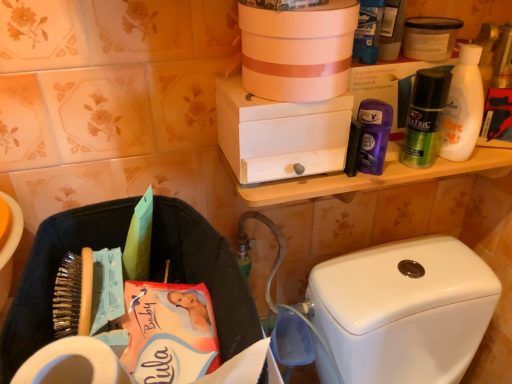
What do you see at coordinates (430, 38) in the screenshot? The height and width of the screenshot is (384, 512). I see `white matte container at upper right` at bounding box center [430, 38].

In order to face white matte toilet paper at lower left, should I rotate leftwards or rightwards?

Rotate left and turn 21.278 degrees.

Identify the location of white matte box at upper center, the second box viewed from the top. (280, 133).

Identify the location of white matte container at upper right. (430, 38).

Is green matte deodorant at upper right, the 2th toiletry when ordered from left to right, positioned far away from white matte container at upper right?

No, there isn't a large distance between green matte deodorant at upper right, the 2th toiletry when ordered from left to right, and white matte container at upper right.

How many degrees apart are the facing directions of green matte deodorant at upper right, which is counted as the 1th toiletry, starting from the right, and white matte container at upper right?

The angular difference between green matte deodorant at upper right, which is counted as the 1th toiletry, starting from the right, and white matte container at upper right is 0.00361 degrees.

Does green matte deodorant at upper right, which is counted as the 1th toiletry, starting from the right, have a lesser height compared to white matte container at upper right?

In fact, green matte deodorant at upper right, which is counted as the 1th toiletry, starting from the right, may be taller than white matte container at upper right.

Locate an element on the screen. The height and width of the screenshot is (384, 512). the 1st toiletry below the white matte container at upper right (from the image's perspective) is located at coordinates (425, 117).

The width and height of the screenshot is (512, 384). Identify the location of laundry basket located underneath the white matte bottle at upper right (from a real-world perspective). (52, 280).

Which is farther from the camera, [41,270] or [452,138]?

The point [452,138] is more distant.

Can you confirm if black fabric laundry basket at lower left is smaller than white matte bottle at upper right?

No, black fabric laundry basket at lower left is not smaller than white matte bottle at upper right.

From the image's perspective, is black fabric laundry basket at lower left positioned above or below white matte bottle at upper right?

black fabric laundry basket at lower left is situated lower than white matte bottle at upper right in the image.

From a real-world perspective, is green matte deodorant at upper right, which is counted as the 1th toiletry, starting from the right, positioned under white matte bottle at upper right based on gravity?

Yes, from a real-world perspective, green matte deodorant at upper right, which is counted as the 1th toiletry, starting from the right, is beneath white matte bottle at upper right.

Would you say green matte deodorant at upper right, which is counted as the 1th toiletry, starting from the right, is to the left or to the right of white matte bottle at upper right in the picture?

green matte deodorant at upper right, which is counted as the 1th toiletry, starting from the right, is positioned on white matte bottle at upper right's left side.

Is green matte deodorant at upper right, the 2th toiletry when ordered from left to right, inside or outside of white matte bottle at upper right?

green matte deodorant at upper right, the 2th toiletry when ordered from left to right, cannot be found inside white matte bottle at upper right.

Does green matte deodorant at upper right, which is counted as the 1th toiletry, starting from the right, touch white matte bottle at upper right?

Yes.

Does white matte container at upper right have a smaller size compared to white matte toilet paper at lower left?

Correct, white matte container at upper right occupies less space than white matte toilet paper at lower left.

Is white matte container at upper right not within white matte toilet paper at lower left?

white matte container at upper right lies outside white matte toilet paper at lower left's area.

From a real-world perspective, is white matte container at upper right above or below white matte toilet paper at lower left?

white matte container at upper right is situated higher than white matte toilet paper at lower left in the real world.

I want to click on toilet paper on the left of white matte container at upper right, so click(73, 364).

Which is in front, white glossy toilet tank at lower right or white matte toilet paper at lower left?

white matte toilet paper at lower left is in front.

Based on the photo, from the image's perspective, between white glossy toilet tank at lower right and white matte toilet paper at lower left, who is located below?

From the image's view, white glossy toilet tank at lower right is below.

From a real-world perspective, does white glossy toilet tank at lower right stand above white matte toilet paper at lower left?

Incorrect, from a real-world perspective, white glossy toilet tank at lower right is lower than white matte toilet paper at lower left.

Is white matte box at upper center, acting as the 1th box starting from the bottom, oriented away from white matte bottle at upper right?

No, white matte box at upper center, acting as the 1th box starting from the bottom, is not facing the opposite direction of white matte bottle at upper right.

Which is in front, point (345, 155) or point (467, 147)?

The point (345, 155) is closer.

Find the location of a particular element. The image size is (512, 384). cleaning product that appears on the right of white matte box at upper center, the second box viewed from the top is located at coordinates (463, 107).

Considering the sizes of objects white matte box at upper center, the second box viewed from the top, and white matte bottle at upper right in the image provided, who is taller, white matte box at upper center, the second box viewed from the top, or white matte bottle at upper right?

white matte bottle at upper right.

From the image's perspective, which is below, white glossy toilet tank at lower right or matte white bucket at upper center, the 2th box from the bottom?

white glossy toilet tank at lower right, from the image's perspective.

How many degrees apart are the facing directions of white glossy toilet tank at lower right and matte white bucket at upper center, the 2th box from the bottom?

1.02 degrees separate the facing orientations of white glossy toilet tank at lower right and matte white bucket at upper center, the 2th box from the bottom.

Considering the relative positions of white glossy toilet tank at lower right and matte white bucket at upper center, the 1th box when ordered from top to bottom, in the image provided, is white glossy toilet tank at lower right to the right of matte white bucket at upper center, the 1th box when ordered from top to bottom, from the viewer's perspective?

Yes.

Considering their positions, is white glossy toilet tank at lower right located in front of or behind matte white bucket at upper center, the 1th box when ordered from top to bottom?

white glossy toilet tank at lower right is positioned farther from the viewer than matte white bucket at upper center, the 1th box when ordered from top to bottom.

You are a GUI agent. You are given a task and a screenshot of the screen. Output one action in this format:
    pyautogui.click(x=<x>, y=<y>)
    Task: Click on the product behind the green matte deodorant at upper right, which is counted as the 1th toiletry, starting from the right
    This screenshot has width=512, height=384.
    Given the screenshot: What is the action you would take?
    pyautogui.click(x=430, y=38)

Locate an element on the screen. laundry basket in front of the white matte bottle at upper right is located at coordinates (52, 280).

Based on the photo, from the image, which object appears to be farther from black fabric laundry basket at lower left, white matte container at upper right or white matte bottle at upper right?

Among the two, white matte container at upper right is located further to black fabric laundry basket at lower left.

From the image, which object appears to be nearer to matte white bucket at upper center, the 1th box when ordered from top to bottom, white matte bottle at upper right or white matte container at upper right?

white matte container at upper right.

Based on their spatial positions, is white matte container at upper right or white matte box at upper center, acting as the 1th box starting from the bottom, further from purple glossy deodorant at upper right, arranged as the first toiletry when viewed from the left?

Among the two, white matte container at upper right is located further to purple glossy deodorant at upper right, arranged as the first toiletry when viewed from the left.

Estimate the real-world distances between objects in this image. Which object is further from purple glossy deodorant at upper right, arranged as the first toiletry when viewed from the left, white matte box at upper center, acting as the 1th box starting from the bottom, or black fabric laundry basket at lower left?

Among the two, black fabric laundry basket at lower left is located further to purple glossy deodorant at upper right, arranged as the first toiletry when viewed from the left.

When comparing their distances from white matte toilet paper at lower left, does matte white bucket at upper center, the 2th box from the bottom, or purple glossy deodorant at upper right, arranged as the first toiletry when viewed from the left, seem closer?

matte white bucket at upper center, the 2th box from the bottom.

Considering their positions, is white matte toilet paper at lower left positioned further to matte white bucket at upper center, the 1th box when ordered from top to bottom, than green matte deodorant at upper right, which is counted as the 1th toiletry, starting from the right?

white matte toilet paper at lower left is further to matte white bucket at upper center, the 1th box when ordered from top to bottom.

Estimate the real-world distances between objects in this image. Which object is closer to matte white bucket at upper center, the 1th box when ordered from top to bottom, white matte toilet paper at lower left or white matte box at upper center, acting as the 1th box starting from the bottom?

white matte box at upper center, acting as the 1th box starting from the bottom.

From the image, which object appears to be nearer to white matte toilet paper at lower left, matte white bucket at upper center, the 1th box when ordered from top to bottom, or white glossy toilet tank at lower right?

matte white bucket at upper center, the 1th box when ordered from top to bottom, lies closer to white matte toilet paper at lower left than the other object.

Locate an element on the screen. laundry basket between white matte container at upper right and white glossy toilet tank at lower right vertically is located at coordinates (52, 280).

This screenshot has height=384, width=512. Find the location of `cleaning product between matte white bucket at upper center, the 1th box when ordered from top to bottom, and white glossy toilet tank at lower right, in the vertical direction`. cleaning product between matte white bucket at upper center, the 1th box when ordered from top to bottom, and white glossy toilet tank at lower right, in the vertical direction is located at coordinates (463, 107).

Locate an element on the screen. The image size is (512, 384). toilet paper between purple glossy deodorant at upper right, arranged as the first toiletry when viewed from the left, and white glossy toilet tank at lower right from top to bottom is located at coordinates (73, 364).

I want to click on toiletry that lies between white matte container at upper right and purple glossy deodorant at upper right, arranged as the first toiletry when viewed from the left, from top to bottom, so click(425, 117).